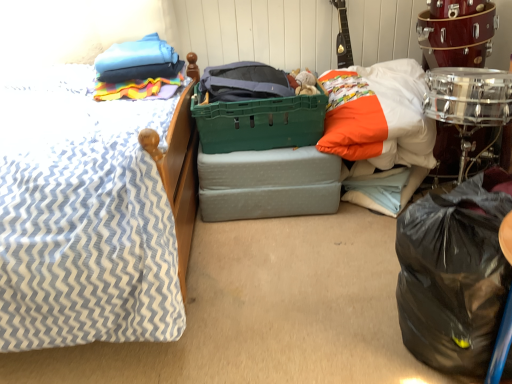
Question: Is the surface of white cotton pillow at upper right, marked as the first pillow in a right-to-left arrangement, in direct contact with black plastic bag at lower right?

Choices:
 (A) no
 (B) yes

Answer: (A)

Question: Is white cotton pillow at upper right, marked as the first pillow in a right-to-left arrangement, facing towards black plastic bag at lower right?

Choices:
 (A) yes
 (B) no

Answer: (A)

Question: Can you confirm if white cotton pillow at upper right, which appears as the second pillow when viewed from the left, is positioned to the left of black plastic bag at lower right?

Choices:
 (A) no
 (B) yes

Answer: (B)

Question: Is white cotton pillow at upper right, marked as the first pillow in a right-to-left arrangement, positioned beyond the bounds of black plastic bag at lower right?

Choices:
 (A) yes
 (B) no

Answer: (A)

Question: Does white cotton pillow at upper right, marked as the first pillow in a right-to-left arrangement, have a greater height compared to black plastic bag at lower right?

Choices:
 (A) yes
 (B) no

Answer: (B)

Question: Can you confirm if white cotton pillow at upper right, which appears as the second pillow when viewed from the left, is wider than black plastic bag at lower right?

Choices:
 (A) yes
 (B) no

Answer: (A)

Question: Is blue fabric pillow at upper left, which is the first pillow from left to right, at the right side of white cotton pillow at upper right, which appears as the second pillow when viewed from the left?

Choices:
 (A) no
 (B) yes

Answer: (A)

Question: Can you confirm if blue fabric pillow at upper left, the 2th pillow when ordered from right to left, is shorter than white cotton pillow at upper right, which appears as the second pillow when viewed from the left?

Choices:
 (A) no
 (B) yes

Answer: (B)

Question: Is blue fabric pillow at upper left, the 2th pillow when ordered from right to left, with white cotton pillow at upper right, marked as the first pillow in a right-to-left arrangement?

Choices:
 (A) no
 (B) yes

Answer: (A)

Question: Can you confirm if blue fabric pillow at upper left, which is the first pillow from left to right, is wider than white cotton pillow at upper right, marked as the first pillow in a right-to-left arrangement?

Choices:
 (A) yes
 (B) no

Answer: (B)

Question: Are blue fabric pillow at upper left, which is the first pillow from left to right, and white cotton pillow at upper right, which appears as the second pillow when viewed from the left, located far from each other?

Choices:
 (A) yes
 (B) no

Answer: (B)

Question: Is blue fabric pillow at upper left, which is the first pillow from left to right, smaller than white cotton pillow at upper right, which appears as the second pillow when viewed from the left?

Choices:
 (A) yes
 (B) no

Answer: (A)

Question: Does shiny silver drum at right come behind black plastic bag at lower right?

Choices:
 (A) yes
 (B) no

Answer: (A)